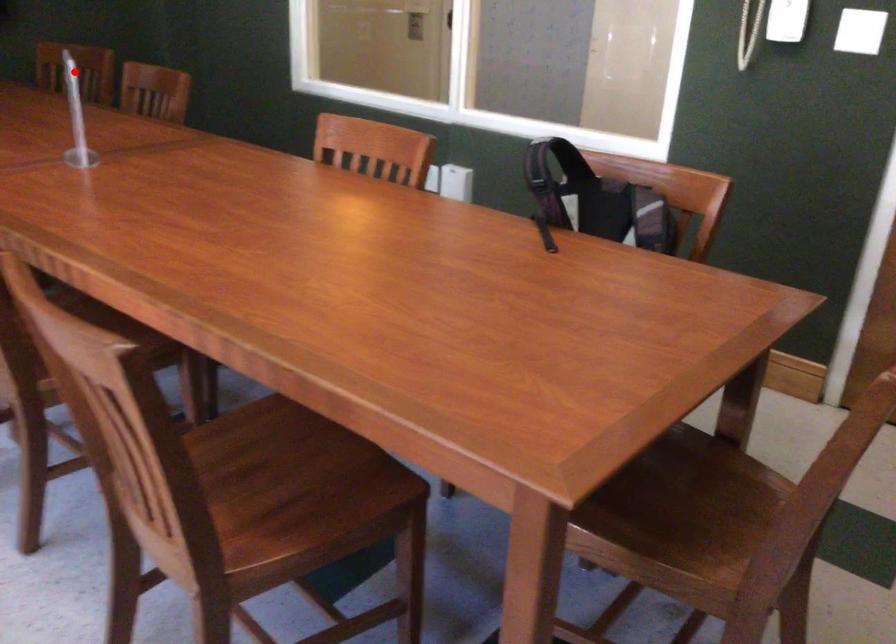
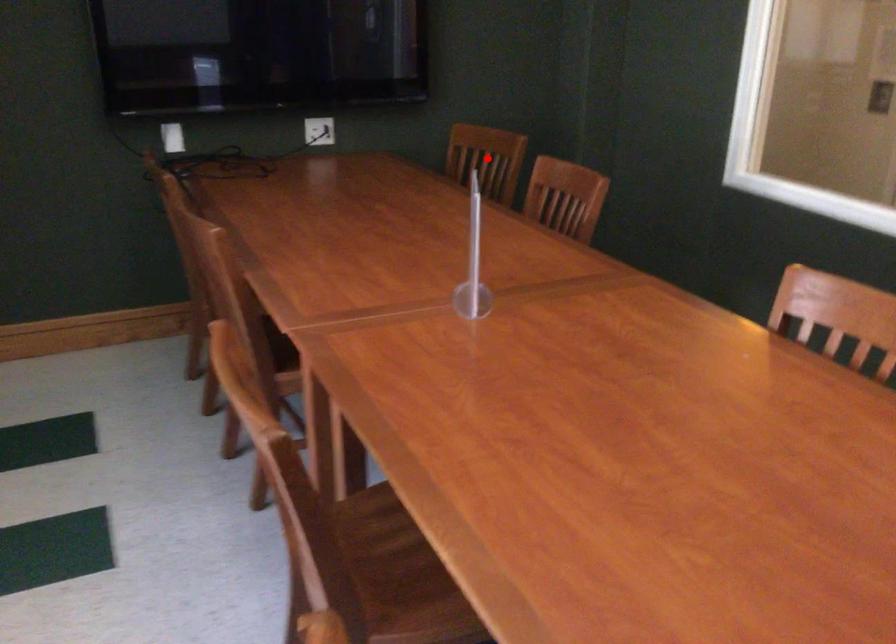
I am providing you with two images of the same scene from different viewpoints. A red point is marked on the first image and another point is marked on the second image. Is the marked point in image1 the same physical position as the marked point in image2?

Yes